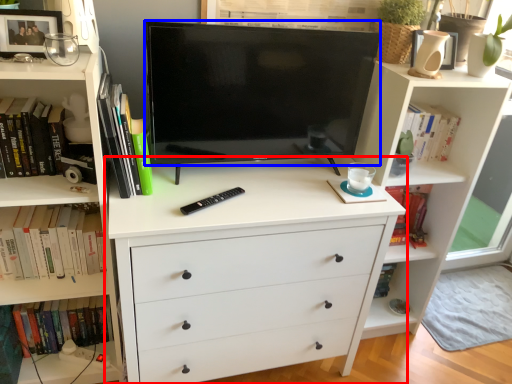
Question: Which point is further to the camera, chest of drawers (highlighted by a red box) or television (highlighted by a blue box)?

Choices:
 (A) chest of drawers
 (B) television

Answer: (A)